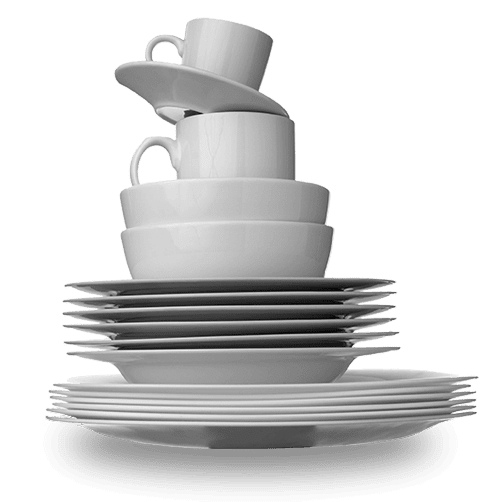
I want to click on bowls, so click(73, 358), click(73, 344), click(78, 326), click(78, 317), click(78, 304), click(81, 288), click(176, 259), click(182, 206).